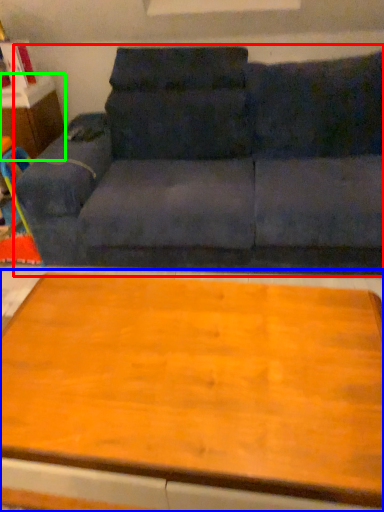
Question: Based on their relative distances, which object is nearer to studio couch (highlighted by a red box)? Choose from table (highlighted by a blue box) and dresser (highlighted by a green box).

Choices:
 (A) table
 (B) dresser

Answer: (B)